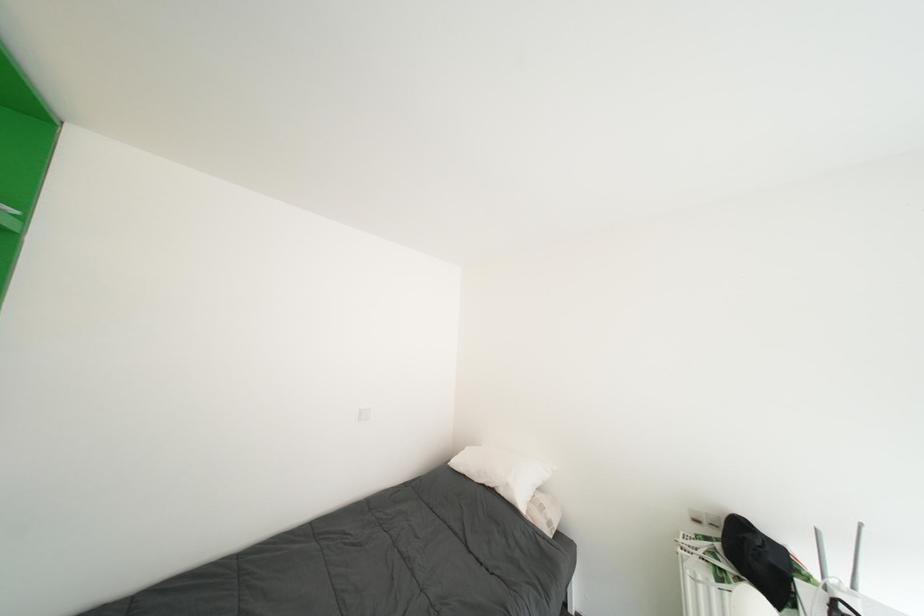
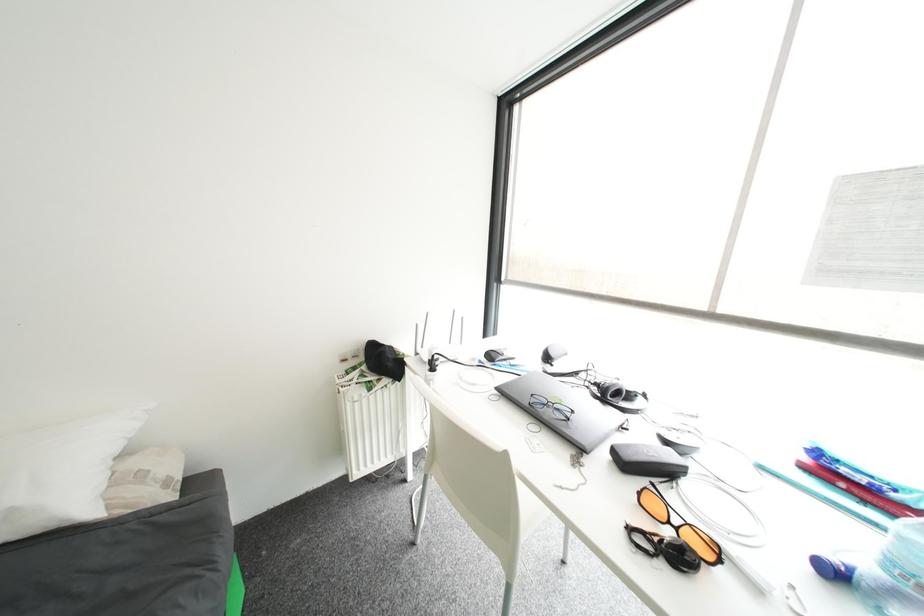
Based on the continuous images, in which direction is the camera rotating?

The camera's rotation is toward right-down.